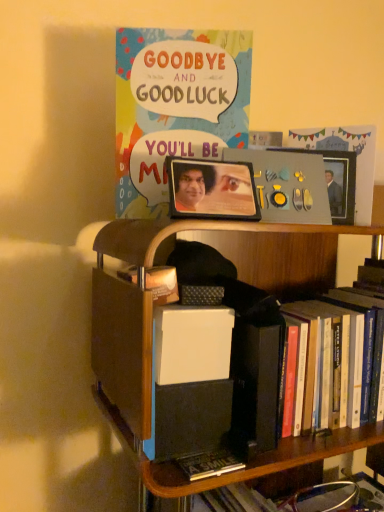
Question: From a real-world perspective, is wooden bookcase at center under metallic silver picture frame at upper right, acting as the 1th picture frame starting from the back?

Choices:
 (A) yes
 (B) no

Answer: (A)

Question: Is wooden bookcase at center positioned with its back to metallic silver picture frame at upper right, the first picture frame in the right-to-left sequence?

Choices:
 (A) no
 (B) yes

Answer: (A)

Question: Is wooden bookcase at center at the left side of metallic silver picture frame at upper right, the first picture frame in the right-to-left sequence?

Choices:
 (A) no
 (B) yes

Answer: (B)

Question: Is wooden bookcase at center behind metallic silver picture frame at upper right, the second picture frame when ordered from front to back?

Choices:
 (A) no
 (B) yes

Answer: (A)

Question: Are wooden bookcase at center and metallic silver picture frame at upper right, acting as the 1th picture frame starting from the back, far apart?

Choices:
 (A) yes
 (B) no

Answer: (B)

Question: Is wooden bookcase at center taller or shorter than metallic silver picture frame at upper right, the 2th picture frame positioned from the left?

Choices:
 (A) short
 (B) tall

Answer: (B)

Question: From the image's perspective, relative to metallic silver picture frame at upper right, the second picture frame when ordered from front to back, is wooden bookcase at center above or below?

Choices:
 (A) below
 (B) above

Answer: (A)

Question: Is wooden bookcase at center spatially inside metallic silver picture frame at upper right, the second picture frame when ordered from front to back, or outside of it?

Choices:
 (A) inside
 (B) outside

Answer: (B)

Question: Visually, is wooden bookcase at center positioned to the left or to the right of metallic silver picture frame at upper right, the second picture frame when ordered from front to back?

Choices:
 (A) right
 (B) left

Answer: (B)

Question: Based on their sizes in the image, would you say metallic silver picture frame at upper right, the first picture frame in the right-to-left sequence, is bigger or smaller than matte paper comic book at upper center?

Choices:
 (A) big
 (B) small

Answer: (B)

Question: Is metallic silver picture frame at upper right, acting as the 1th picture frame starting from the back, inside the boundaries of matte paper comic book at upper center, or outside?

Choices:
 (A) inside
 (B) outside

Answer: (B)

Question: Is metallic silver picture frame at upper right, the second picture frame when ordered from front to back, taller or shorter than matte paper comic book at upper center?

Choices:
 (A) short
 (B) tall

Answer: (A)

Question: Considering their positions, is metallic silver picture frame at upper right, the 2th picture frame positioned from the left, located in front of or behind matte paper comic book at upper center?

Choices:
 (A) behind
 (B) front

Answer: (A)

Question: In terms of width, does metallic silver picture frame at upper right, the first picture frame in the right-to-left sequence, look wider or thinner when compared to wooden bookcase at center?

Choices:
 (A) thin
 (B) wide

Answer: (A)

Question: From a real-world perspective, is metallic silver picture frame at upper right, the second picture frame when ordered from front to back, positioned above or below wooden bookcase at center?

Choices:
 (A) below
 (B) above

Answer: (B)